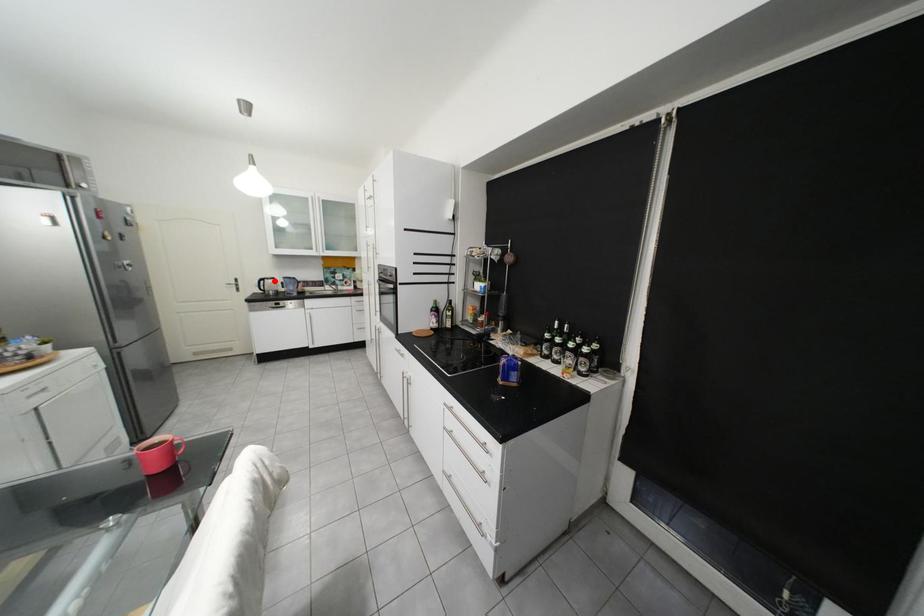
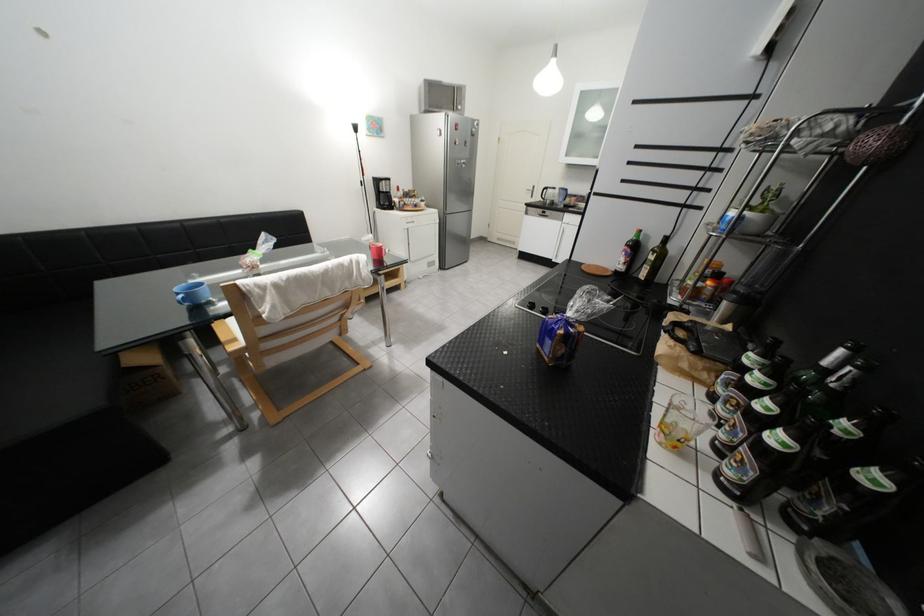
Question: I am providing you with two images of the same scene from different viewpoints. In image1, a red point is highlighted. Considering the same 3D point in image2, which of the following is correct?

Choices:
 (A) It is closer
 (B) It is farther

Answer: (A)